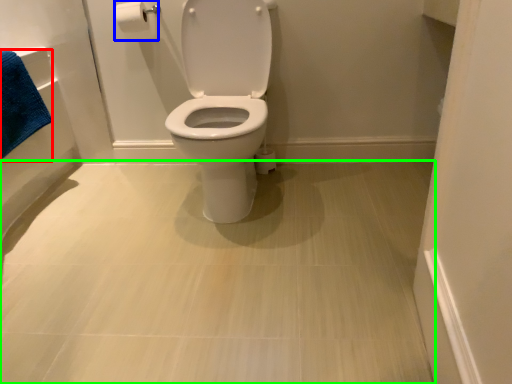
Question: Considering the real-world distances, which object is closest to bath towel (highlighted by a red box)? toilet paper (highlighted by a blue box) or plain (highlighted by a green box).

Choices:
 (A) toilet paper
 (B) plain

Answer: (A)